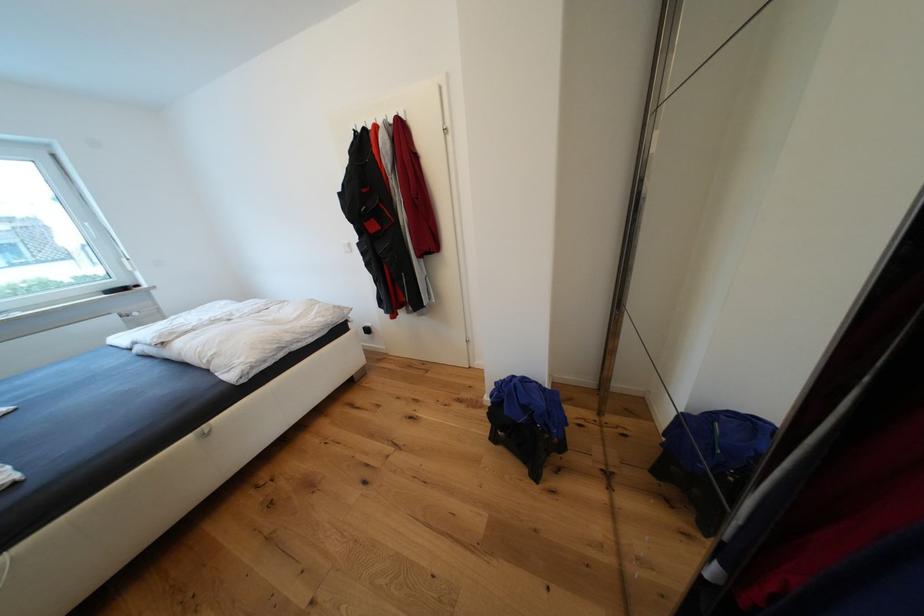
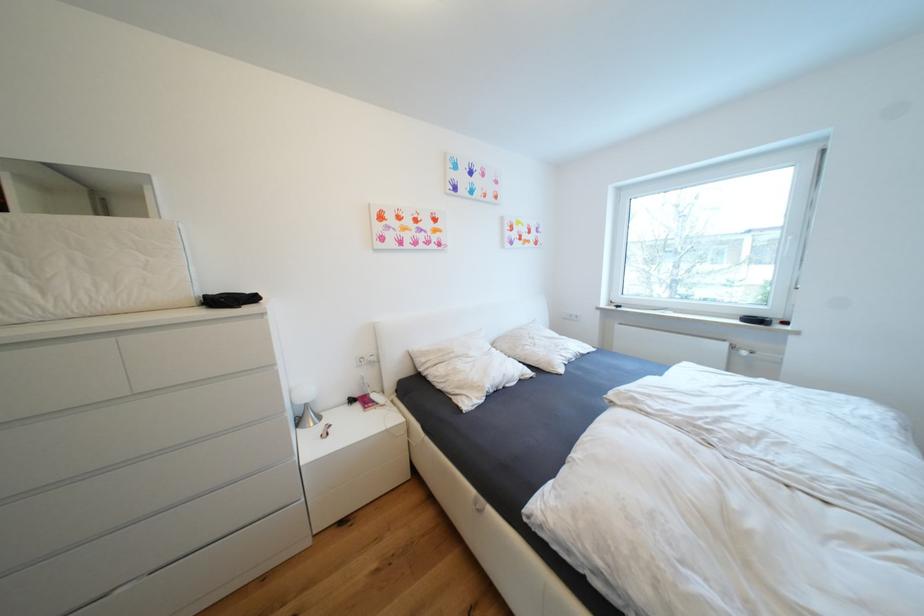
Where in the second image is the point corresponding to the point at 122,317 from the first image?

(733, 346)